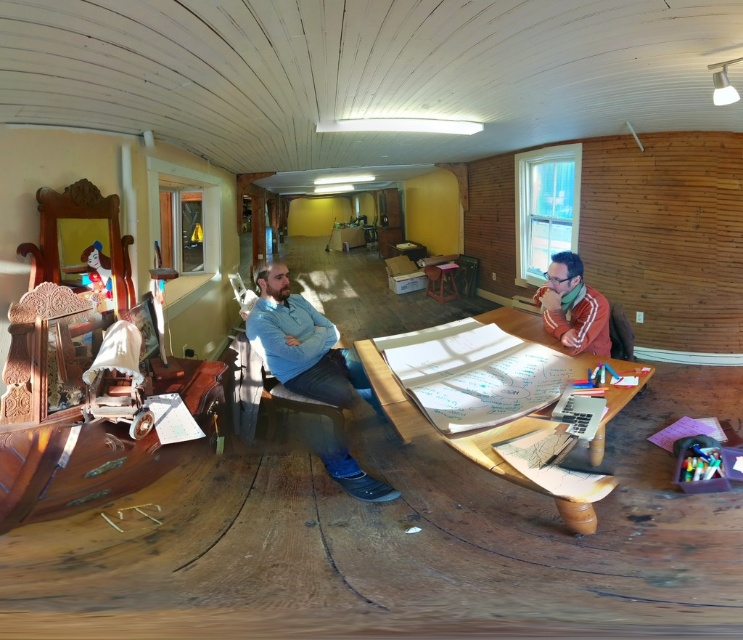
Question: Is blue jeans at center positioned at the back of reddish-brown leather jacket at right?

Choices:
 (A) yes
 (B) no

Answer: (A)

Question: Is blue jeans at center to the left of reddish-brown leather jacket at right from the viewer's perspective?

Choices:
 (A) yes
 (B) no

Answer: (A)

Question: Is blue jeans at center smaller than reddish-brown leather jacket at right?

Choices:
 (A) no
 (B) yes

Answer: (A)

Question: Which object appears farthest from the camera in this image?

Choices:
 (A) blue jeans at center
 (B) reddish-brown leather jacket at right

Answer: (A)

Question: Which point appears closest to the camera in this image?

Choices:
 (A) (561, 275)
 (B) (302, 298)

Answer: (A)